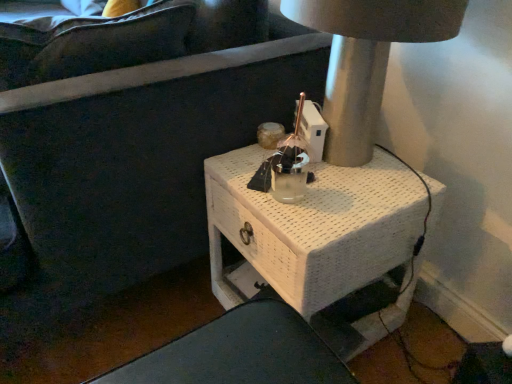
What is the approximate height of white woven table at center?

It is 19.82 inches.

What do you see at coordinates (320, 224) in the screenshot?
I see `white woven table at center` at bounding box center [320, 224].

Image resolution: width=512 pixels, height=384 pixels. I want to click on white woven table at center, so (x=320, y=224).

The image size is (512, 384). What do you see at coordinates (366, 59) in the screenshot? I see `matte gray table lamp at upper right` at bounding box center [366, 59].

Where is `matte gray table lamp at upper right`? matte gray table lamp at upper right is located at coordinates (366, 59).

I want to click on white woven table at center, so click(x=320, y=224).

Between matte gray table lamp at upper right and white woven table at center, which one appears on the right side from the viewer's perspective?

matte gray table lamp at upper right.

In the image, is matte gray table lamp at upper right positioned in front of or behind white woven table at center?

matte gray table lamp at upper right is in front of white woven table at center.

Does point (385, 31) appear closer or farther from the camera than point (313, 241)?

Clearly, point (385, 31) is closer to the camera than point (313, 241).

From the image's perspective, between matte gray table lamp at upper right and white woven table at center, who is located below?

white woven table at center, from the image's perspective.

From a real-world perspective, is matte gray table lamp at upper right above or below white woven table at center?

From a real-world perspective, matte gray table lamp at upper right is physically above white woven table at center.

Between matte gray table lamp at upper right and white woven table at center, which one has smaller width?

matte gray table lamp at upper right is thinner.

Considering the sizes of objects matte gray table lamp at upper right and white woven table at center in the image provided, who is taller, matte gray table lamp at upper right or white woven table at center?

Standing taller between the two is white woven table at center.

Considering the sizes of objects matte gray table lamp at upper right and white woven table at center in the image provided, who is bigger, matte gray table lamp at upper right or white woven table at center?

white woven table at center.

Would you say white woven table at center is part of matte gray table lamp at upper right's contents?

Actually, white woven table at center is outside matte gray table lamp at upper right.

Is matte gray table lamp at upper right far from white woven table at center?

matte gray table lamp at upper right is actually quite close to white woven table at center.

Looking at this image, is matte gray table lamp at upper right oriented towards white woven table at center?

No, matte gray table lamp at upper right is not turned towards white woven table at center.

You are a GUI agent. You are given a task and a screenshot of the screen. Output one action in this format:
    pyautogui.click(x=<x>, y=<y>)
    Task: Click on the table lamp above the white woven table at center (from a real-world perspective)
    This screenshot has width=512, height=384.
    Given the screenshot: What is the action you would take?
    pyautogui.click(x=366, y=59)

Between white woven table at center and matte gray table lamp at upper right, which one appears on the left side from the viewer's perspective?

white woven table at center is more to the left.

Which object is more forward, white woven table at center or matte gray table lamp at upper right?

matte gray table lamp at upper right is closer to the camera.

Does point (226, 170) come behind point (331, 30)?

Yes, it is behind point (331, 30).

From the image's perspective, is white woven table at center on matte gray table lamp at upper right?

No.

From a real-world perspective, is white woven table at center positioned above or below matte gray table lamp at upper right?

From a real-world perspective, white woven table at center is physically below matte gray table lamp at upper right.

Consider the image. Is white woven table at center wider or thinner than matte gray table lamp at upper right?

white woven table at center is wider than matte gray table lamp at upper right.

Between white woven table at center and matte gray table lamp at upper right, which one has more height?

white woven table at center is taller.

Considering the relative sizes of white woven table at center and matte gray table lamp at upper right in the image provided, is white woven table at center smaller than matte gray table lamp at upper right?

Actually, white woven table at center might be larger than matte gray table lamp at upper right.

Is white woven table at center positioned beyond the bounds of matte gray table lamp at upper right?

That's correct, white woven table at center is outside of matte gray table lamp at upper right.

Is white woven table at center not close to matte gray table lamp at upper right?

white woven table at center is near matte gray table lamp at upper right, not far away.

Is white woven table at center facing towards matte gray table lamp at upper right?

No, white woven table at center is not aimed at matte gray table lamp at upper right.

Can you tell me how much white woven table at center and matte gray table lamp at upper right differ in facing direction?

There is a 1.13-degree angle between the facing directions of white woven table at center and matte gray table lamp at upper right.

This screenshot has height=384, width=512. I want to click on table lamp in front of the white woven table at center, so click(x=366, y=59).

The width and height of the screenshot is (512, 384). In order to click on table on the left side of matte gray table lamp at upper right in this screenshot , I will do `click(320, 224)`.

Where is `table lamp to the right of white woven table at center`? This screenshot has width=512, height=384. table lamp to the right of white woven table at center is located at coordinates (366, 59).